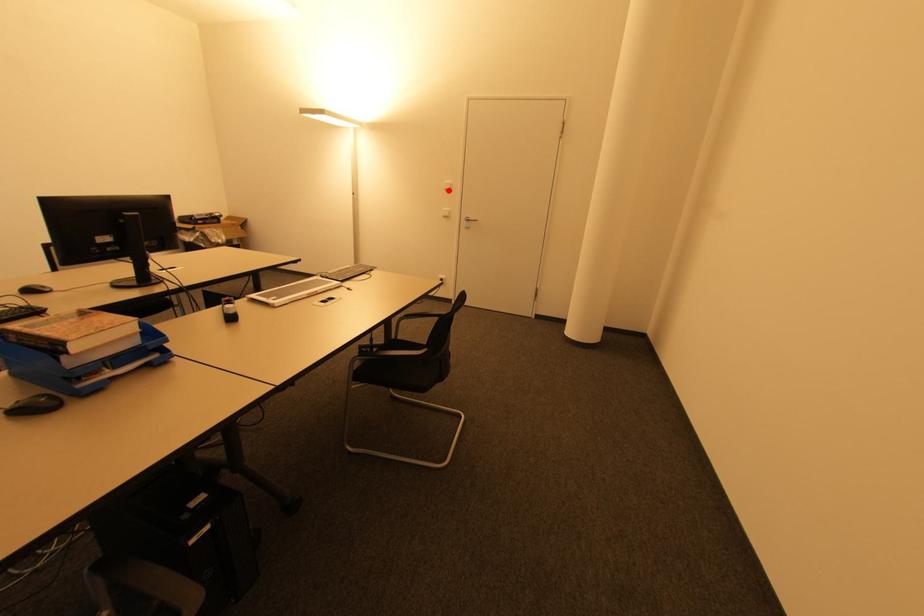
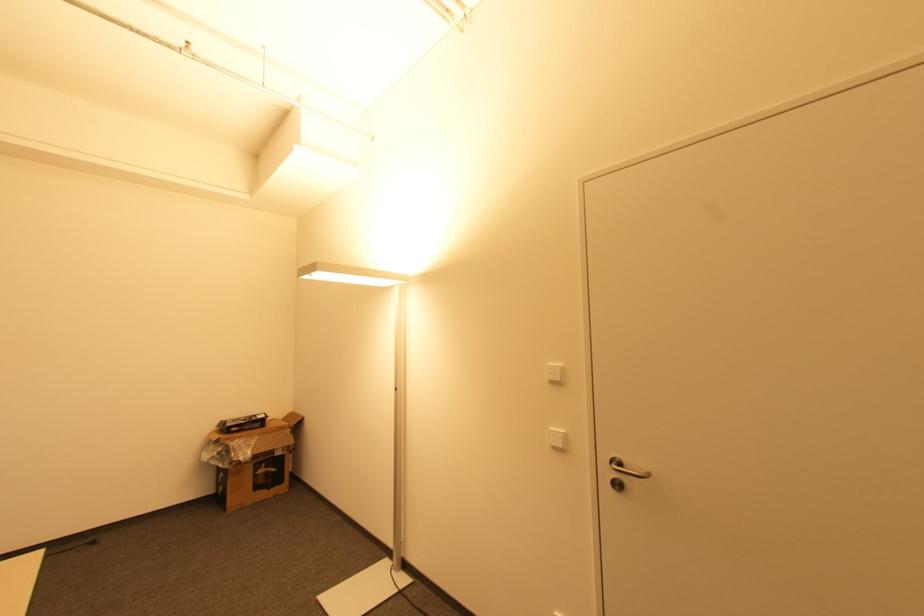
Question: I am providing you with two images of the same scene from different viewpoints. Given a red point in image1, look at the same physical point in image2. Is it:

Choices:
 (A) Closer to the viewpoint
 (B) Farther from the viewpoint

Answer: (B)